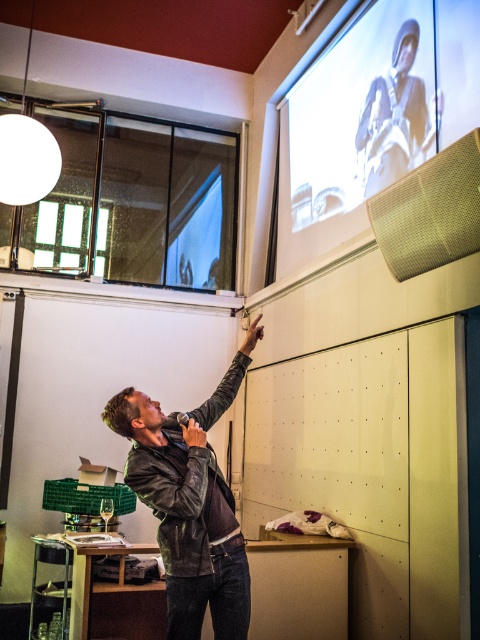
Which is more to the right, white matte projection screen at upper right or leather jacket at center?

From the viewer's perspective, white matte projection screen at upper right appears more on the right side.

Does white matte projection screen at upper right appear under leather jacket at center?

No, white matte projection screen at upper right is not below leather jacket at center.

Between point (349, 196) and point (210, 570), which one is positioned in front?

Point (210, 570) is more forward.

This screenshot has width=480, height=640. In order to click on white matte projection screen at upper right in this screenshot , I will do `click(350, 131)`.